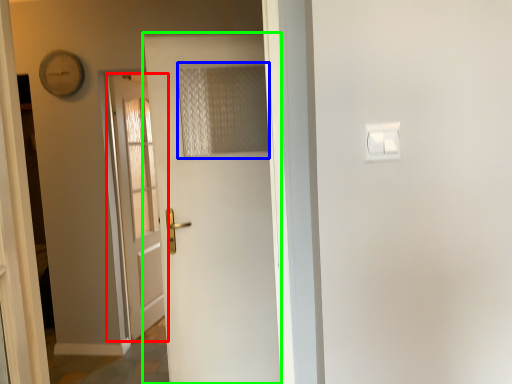
Question: Which object is positioned closest to door (highlighted by a red box)? Select from curtain (highlighted by a blue box) and door (highlighted by a green box).

Choices:
 (A) curtain
 (B) door

Answer: (B)